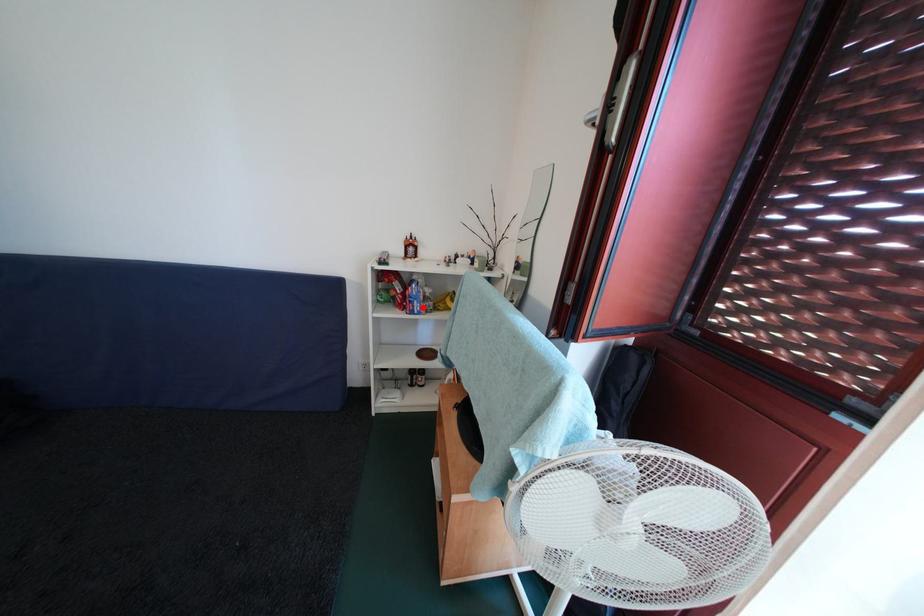
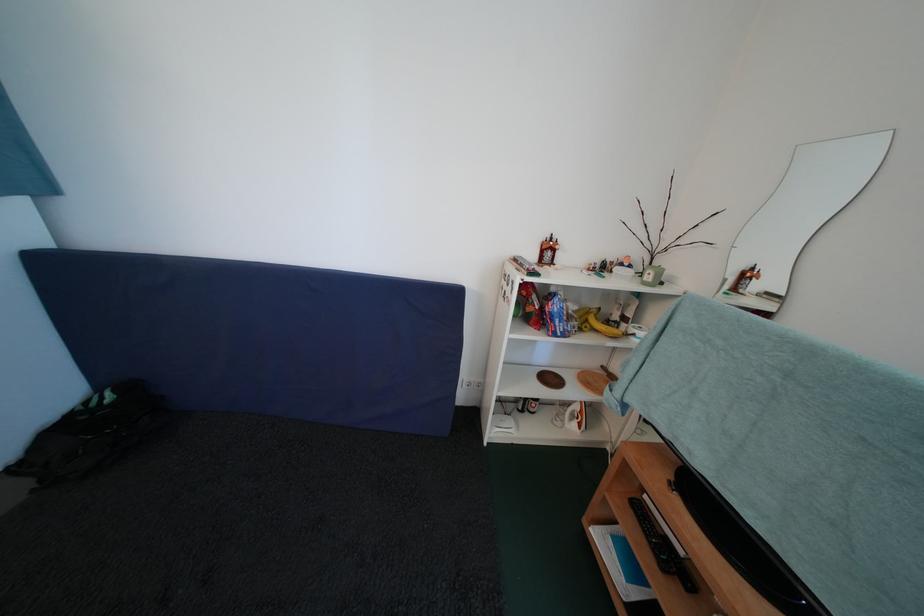
Where in the second image is the point corresponding to the highlighted location from the first image?

(565, 326)